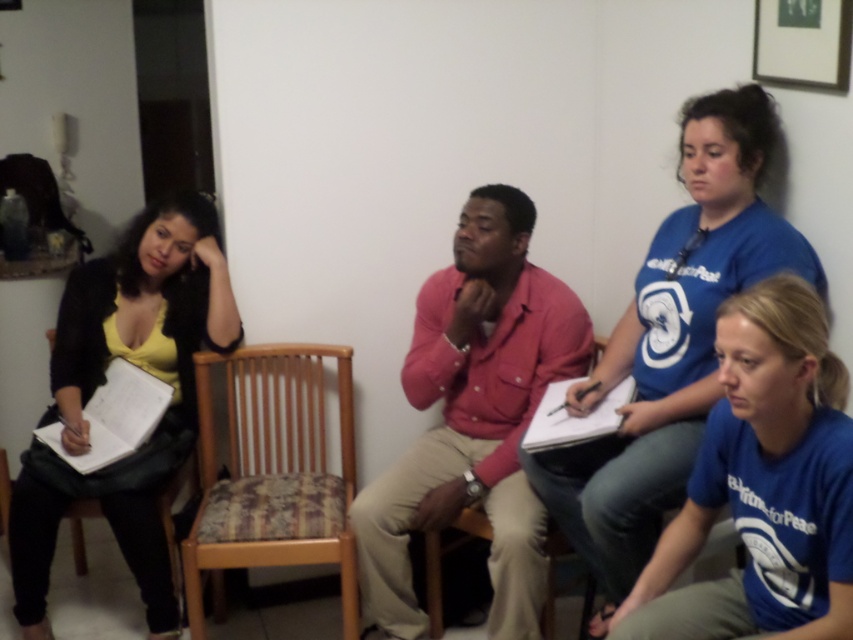
You are organizing a small event and need to know the seating arrangement. Which object takes up more space in the image, the blue cotton shirt at upper right or the woodenwoodenchair at center?

The blue cotton shirt at upper right is bigger than the woodenwoodenchair at center, so it takes up more space in the image.

You are trying to find the woodenwoodenchair at center in the image. Where would you look relative to the wooden chair at center?

The woodenwoodenchair at center is positioned over the wooden chair at center, so you should look directly above the wooden chair at center to find it.

You are standing in the room where the four people are sitting. You need to locate the blue cotton shirt at upper right. According to the coordinates provided, where exactly should you look to find it?

The blue cotton shirt at upper right is located at the coordinates point 0.534 on the x axis and 0.789 on the y axis.